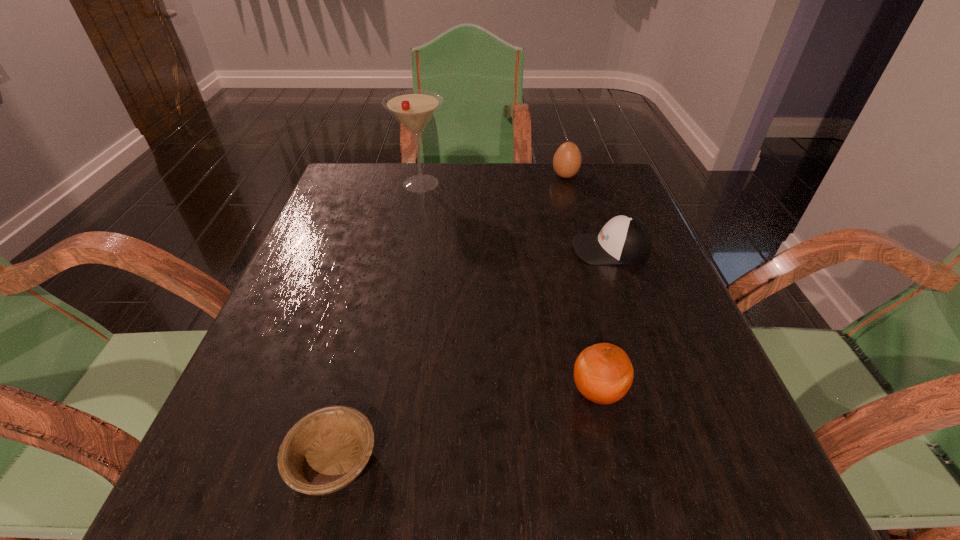
Locate an element on the screen. The width and height of the screenshot is (960, 540). orange that is at the right edge is located at coordinates (603, 373).

Where is `cap situated at the right edge`? Image resolution: width=960 pixels, height=540 pixels. cap situated at the right edge is located at coordinates (625, 239).

The image size is (960, 540). In order to click on object located at the far left corner in this screenshot , I will do `click(413, 109)`.

Identify the location of object that is at the near left corner. click(327, 449).

Image resolution: width=960 pixels, height=540 pixels. Find the location of `object located at the far right corner`. object located at the far right corner is located at coordinates (567, 160).

Locate an element on the screen. vacant space at the far edge of the desktop is located at coordinates (535, 183).

Identify the location of vacant space at the left edge of the desktop. This screenshot has height=540, width=960. (287, 336).

The width and height of the screenshot is (960, 540). I want to click on vacant space at the right edge of the desktop, so click(x=672, y=296).

This screenshot has width=960, height=540. I want to click on blank space at the far right corner of the desktop, so click(x=612, y=162).

You are a GUI agent. You are given a task and a screenshot of the screen. Output one action in this format:
    pyautogui.click(x=<x>, y=<y>)
    Task: Click on the free space between the cap and the fourth farthest object
    
    Given the screenshot: What is the action you would take?
    pyautogui.click(x=604, y=320)